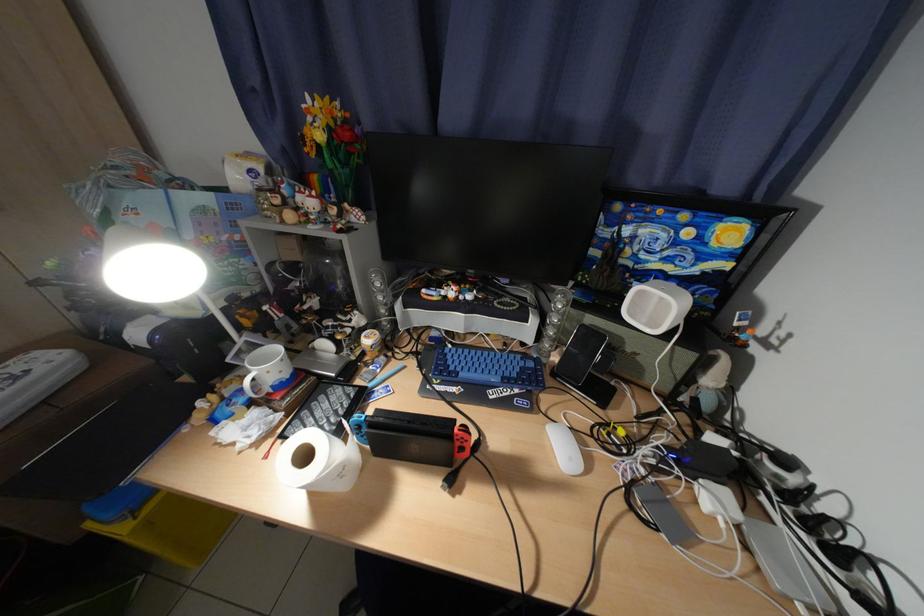
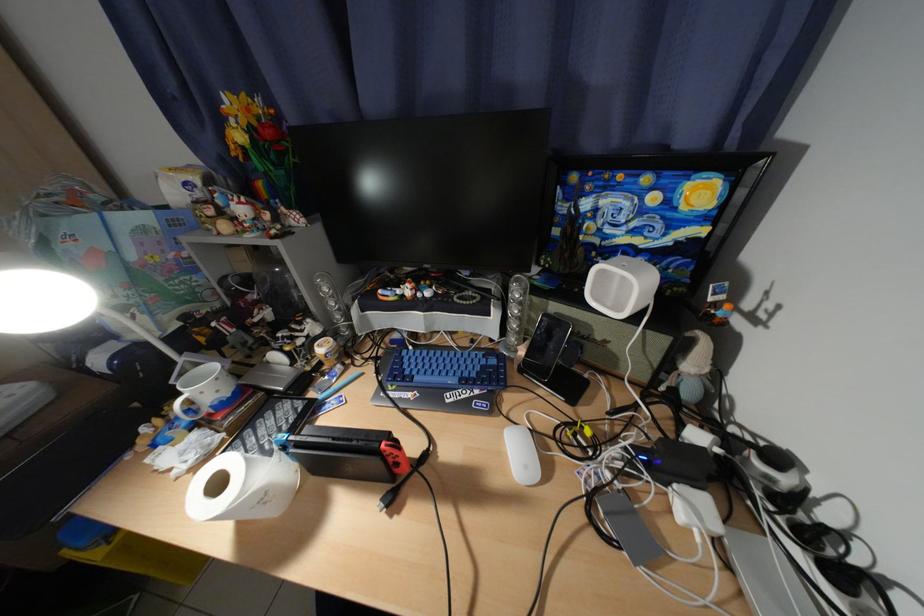
Find the pixel in the second image that matches (x=651, y=294) in the first image.

(613, 273)